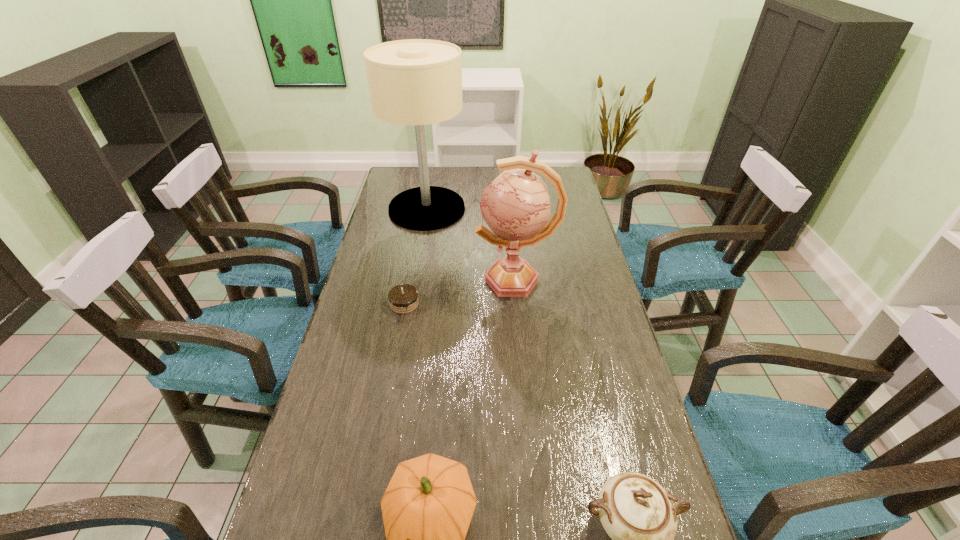
The width and height of the screenshot is (960, 540). Find the location of `table lamp located in the left edge section of the desktop`. table lamp located in the left edge section of the desktop is located at coordinates (417, 82).

In order to click on chocolate cake located in the left edge section of the desktop in this screenshot , I will do `click(403, 299)`.

Identify the location of object present at the right edge. The image size is (960, 540). (516, 205).

Where is `object located in the far left corner section of the desktop`? object located in the far left corner section of the desktop is located at coordinates (417, 82).

Find the location of a particular element. This screenshot has width=960, height=540. vacant position at the far edge of the desktop is located at coordinates (470, 179).

This screenshot has height=540, width=960. In order to click on vacant space at the left edge of the desktop in this screenshot , I will do `click(277, 532)`.

At what (x,y) coordinates should I click in order to perform the action: click on free space at the right edge of the desktop. Please return your answer as a coordinate pair (x, y). The width and height of the screenshot is (960, 540). Looking at the image, I should click on (603, 339).

The width and height of the screenshot is (960, 540). In the image, there is a desktop. What are the coordinates of `vacant space at the far right corner` in the screenshot? It's located at (567, 167).

The image size is (960, 540). Find the location of `vacant space that's between the fourth shortest object and the shortest object`. vacant space that's between the fourth shortest object and the shortest object is located at coordinates (460, 292).

At what (x,y) coordinates should I click in order to perform the action: click on free space that is in between the tallest object and the fourth shortest object. Please return your answer as a coordinate pair (x, y). Looking at the image, I should click on (471, 244).